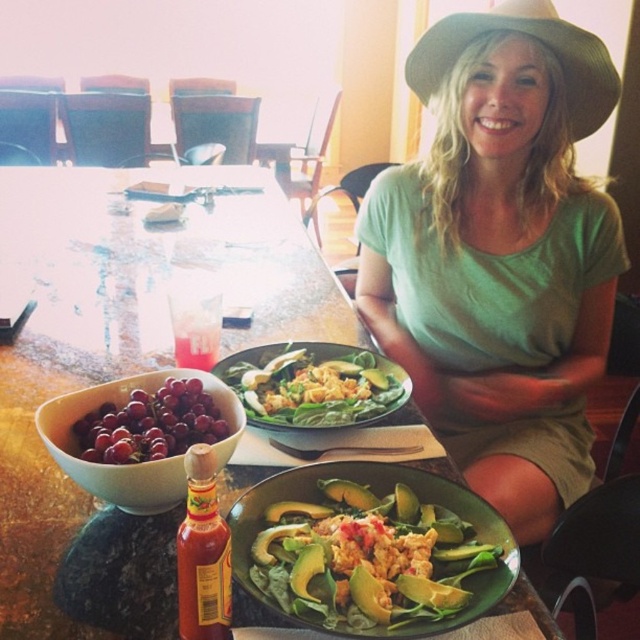
You are a guest at the table and want to grab a grape from the shiny red grapes at lower left without touching the green cotton shirt at center. Is this possible based on their positions?

The green cotton shirt at center is to the right of the shiny red grapes at lower left, so there is space between them. Therefore, you can reach the grapes without touching the shirt.

You are standing in front of the dining table and want to reach the green cotton shirt at center to hand over a napkin. Can you comfortably extend your arm to do so?

The green cotton shirt at center and viewer are 39.36 inches apart, which is about 3.28 feet. Since the average arm length is around 2.5 feet, you may need to take a small step forward to comfortably reach the green cotton shirt at center.